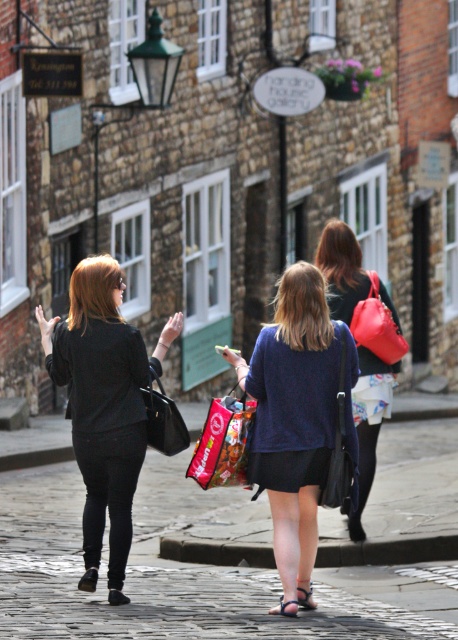
Question: Can you confirm if matte black jacket at left is smaller than matte red handbag at center?

Choices:
 (A) yes
 (B) no

Answer: (B)

Question: Among these points, which one is farthest from the camera?

Choices:
 (A) (381, 320)
 (B) (392, 316)
 (C) (164, 429)

Answer: (B)

Question: Does cobblestone pavement at center have a greater width compared to matte black jacket at center?

Choices:
 (A) yes
 (B) no

Answer: (A)

Question: Which point is closer to the camera?

Choices:
 (A) matte red handbag at center
 (B) cobblestone pavement at center
 (C) matte black jacket at left

Answer: (B)

Question: Is matte black jacket at left to the right of matte red handbag at center from the viewer's perspective?

Choices:
 (A) no
 (B) yes

Answer: (A)

Question: Among these objects, which one is farthest from the camera?

Choices:
 (A) red plastic shopping bag at center
 (B) matte black jacket at center
 (C) blue cotton dress at center
 (D) matte red handbag at center

Answer: (B)